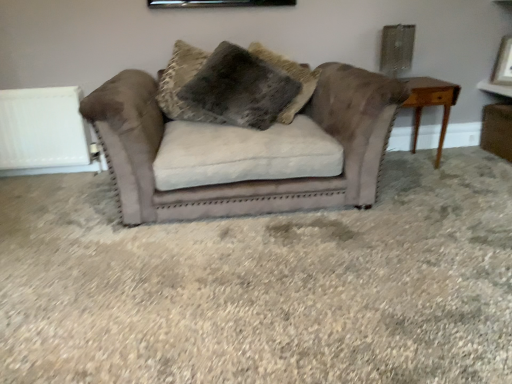
This screenshot has width=512, height=384. I want to click on fuzzy brown pillow at center, so click(236, 90).

What are the coordinates of `suede couch at center` in the screenshot? It's located at (245, 181).

Based on the photo, is fuzzy brown pillow at center touching suede couch at center?

There is a gap between fuzzy brown pillow at center and suede couch at center.

Is fuzzy brown pillow at center not within suede couch at center?

No, fuzzy brown pillow at center is not entirely external to suede couch at center.

Does fuzzy brown pillow at center have a smaller size compared to suede couch at center?

Yes, fuzzy brown pillow at center is smaller than suede couch at center.

Could you tell me if fuzzy brown pillow at center is turned towards suede couch at center?

Yes.

Is white matte radiator at left in front of or behind suede couch at center in the image?

Visually, white matte radiator at left is located behind suede couch at center.

From the picture: How many degrees apart are the facing directions of white matte radiator at left and suede couch at center?

They differ by 0.243 degrees in their facing directions.

Is white matte radiator at left inside the boundaries of suede couch at center, or outside?

white matte radiator at left is not enclosed by suede couch at center.

Considering the sizes of objects white matte radiator at left and suede couch at center in the image provided, who is thinner, white matte radiator at left or suede couch at center?

white matte radiator at left.

Does suede couch at center appear on the left side of light brown wooden table at right?

Yes.

You are a GUI agent. You are given a task and a screenshot of the screen. Output one action in this format:
    pyautogui.click(x=<x>, y=<y>)
    Task: Click on the studio couch that is on the left side of light brown wooden table at right
    
    Given the screenshot: What is the action you would take?
    pyautogui.click(x=245, y=181)

In the scene shown: Is suede couch at center not within light brown wooden table at right?

Indeed, suede couch at center is completely outside light brown wooden table at right.

Is suede couch at center with light brown wooden table at right?

They are not placed beside each other.

Considering the positions of point (30, 151) and point (414, 148), is point (30, 151) closer or farther from the camera than point (414, 148)?

Point (30, 151) is closer to the camera than point (414, 148).

Is white matte radiator at left not within light brown wooden table at right?

That's correct, white matte radiator at left is outside of light brown wooden table at right.

From a real-world perspective, between white matte radiator at left and light brown wooden table at right, who is vertically higher?

white matte radiator at left.

In the image, is white matte radiator at left positioned in front of or behind light brown wooden table at right?

In the image, white matte radiator at left appears behind light brown wooden table at right.

Is fuzzy brown pillow at center bigger than white matte radiator at left?

Yes.

The height and width of the screenshot is (384, 512). What are the coordinates of `pillow lying above the white matte radiator at left (from the image's perspective)` in the screenshot? It's located at (236, 90).

From the image's perspective, which one is positioned higher, fuzzy brown pillow at center or white matte radiator at left?

fuzzy brown pillow at center is shown above in the image.

Is light brown wooden table at right positioned with its back to white matte radiator at left?

That's not correct — light brown wooden table at right is not looking away from white matte radiator at left.

How many degrees apart are the facing directions of light brown wooden table at right and white matte radiator at left?

0.243 degrees.

Considering the relative sizes of light brown wooden table at right and white matte radiator at left in the image provided, is light brown wooden table at right bigger than white matte radiator at left?

Yes, light brown wooden table at right is bigger than white matte radiator at left.

From a real-world perspective, does matte white picture frame at upper right stand above light brown wooden table at right?

Yes, from a real-world perspective, matte white picture frame at upper right is on top of light brown wooden table at right.

Which object is wider, matte white picture frame at upper right or light brown wooden table at right?

light brown wooden table at right.

Is matte white picture frame at upper right oriented towards light brown wooden table at right?

No, matte white picture frame at upper right does not turn towards light brown wooden table at right.

Between matte white picture frame at upper right and light brown wooden table at right, which one has larger size?

light brown wooden table at right.

The width and height of the screenshot is (512, 384). Find the location of `pillow that appears on the left of suede couch at center`. pillow that appears on the left of suede couch at center is located at coordinates (236, 90).

The image size is (512, 384). In the image, there is a suede couch at center. Identify the location of radiator above it (from the image's perspective). (42, 131).

Looking at the image, which one is located closer to suede couch at center, fuzzy brown pillow at center or white matte radiator at left?

Among the two, fuzzy brown pillow at center is located nearer to suede couch at center.

In the scene shown: Looking at the image, which one is located closer to white matte radiator at left, matte white picture frame at upper right or light brown wooden table at right?

Among the two, light brown wooden table at right is located nearer to white matte radiator at left.

Looking at the image, which one is located further to light brown wooden table at right, suede couch at center or matte white picture frame at upper right?

Among the two, suede couch at center is located further to light brown wooden table at right.

Considering their positions, is fuzzy brown pillow at center positioned closer to light brown wooden table at right than white matte radiator at left?

fuzzy brown pillow at center lies closer to light brown wooden table at right than the other object.

Looking at the image, which one is located closer to fuzzy brown pillow at center, white matte radiator at left or light brown wooden table at right?

The object closer to fuzzy brown pillow at center is light brown wooden table at right.

When comparing their distances from white matte radiator at left, does fuzzy brown pillow at center or light brown wooden table at right seem further?

The object further to white matte radiator at left is light brown wooden table at right.

From the image, which object appears to be nearer to light brown wooden table at right, fuzzy brown pillow at center or matte white picture frame at upper right?

The object closer to light brown wooden table at right is matte white picture frame at upper right.

Considering their positions, is light brown wooden table at right positioned closer to fuzzy brown pillow at center than suede couch at center?

Among the two, suede couch at center is located nearer to fuzzy brown pillow at center.

Find the location of a particular element. The width and height of the screenshot is (512, 384). pillow between white matte radiator at left and matte white picture frame at upper right is located at coordinates (236, 90).

I want to click on studio couch between white matte radiator at left and light brown wooden table at right, so click(245, 181).

You are a GUI agent. You are given a task and a screenshot of the screen. Output one action in this format:
    pyautogui.click(x=<x>, y=<y>)
    Task: Click on the table between suede couch at center and matte white picture frame at upper right in the horizontal direction
    This screenshot has height=384, width=512.
    Given the screenshot: What is the action you would take?
    pyautogui.click(x=430, y=105)

Where is `studio couch situated between fuzzy brown pillow at center and light brown wooden table at right from left to right`? Image resolution: width=512 pixels, height=384 pixels. studio couch situated between fuzzy brown pillow at center and light brown wooden table at right from left to right is located at coordinates (245, 181).